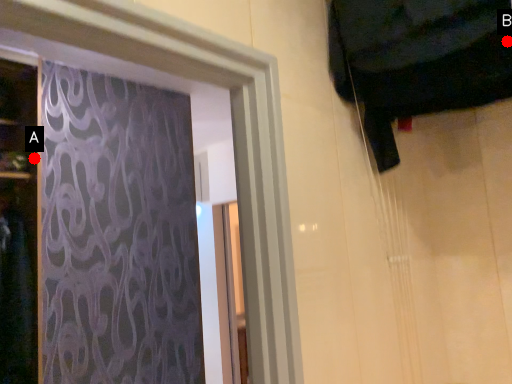
Question: Two points are circled on the image, labeled by A and B beside each circle. Among these points, which one is farthest from the camera?

Choices:
 (A) A is further
 (B) B is further

Answer: (A)